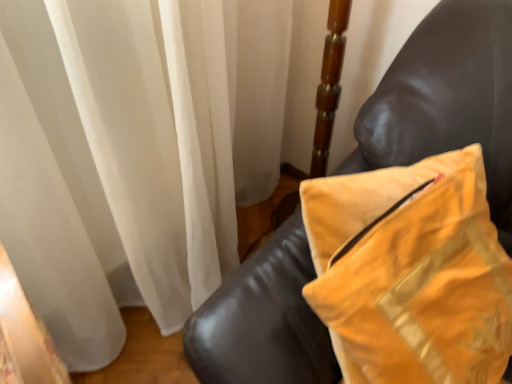
Question: Looking at their shapes, would you say yellow velvet pillow at upper right is wider or thinner than leather couch at right?

Choices:
 (A) thin
 (B) wide

Answer: (A)

Question: From the image's perspective, is yellow velvet pillow at upper right located above or below leather couch at right?

Choices:
 (A) below
 (B) above

Answer: (A)

Question: From a real-world perspective, is yellow velvet pillow at upper right above or below leather couch at right?

Choices:
 (A) below
 (B) above

Answer: (B)

Question: In terms of size, does leather couch at right appear bigger or smaller than yellow velvet pillow at upper right?

Choices:
 (A) small
 (B) big

Answer: (B)

Question: In terms of width, does leather couch at right look wider or thinner when compared to yellow velvet pillow at upper right?

Choices:
 (A) wide
 (B) thin

Answer: (A)

Question: Does point (497, 28) appear closer or farther from the camera than point (492, 241)?

Choices:
 (A) closer
 (B) farther

Answer: (B)

Question: Relative to yellow velvet pillow at upper right, is leather couch at right in front or behind?

Choices:
 (A) behind
 (B) front

Answer: (A)